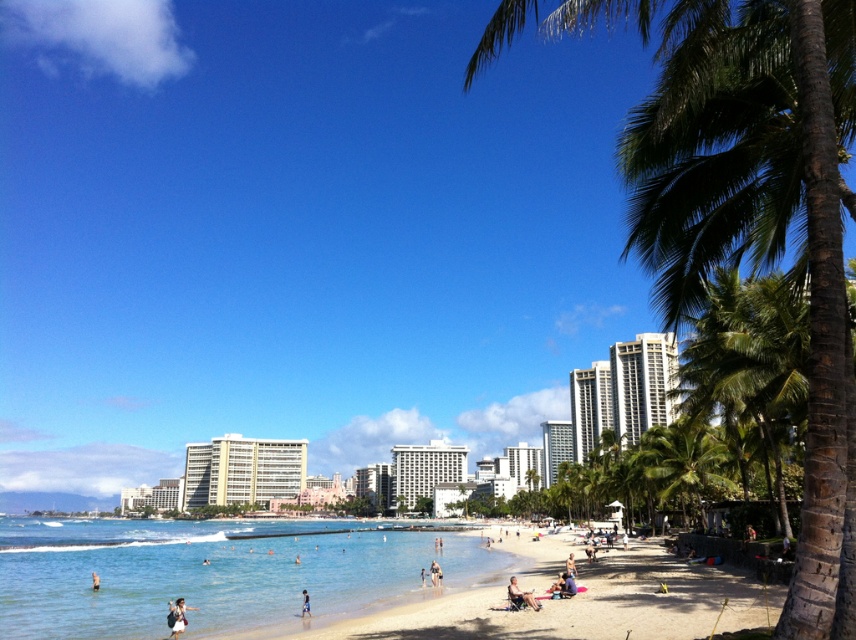
Between beige concrete building at center and light blue fabric at beach center, which one appears on the left side from the viewer's perspective?

beige concrete building at center is more to the left.

Does point (197, 493) come behind point (431, 573)?

That is True.

Locate an element on the screen. The width and height of the screenshot is (856, 640). beige concrete building at center is located at coordinates (242, 470).

Which is below, beige concrete building at center or green leafy palm tree at center-right?

beige concrete building at center

Does beige concrete building at center appear on the right side of green leafy palm tree at center-right?

Incorrect, beige concrete building at center is not on the right side of green leafy palm tree at center-right.

Does point (236, 451) come in front of point (655, 490)?

No, it is not.

You are a GUI agent. You are given a task and a screenshot of the screen. Output one action in this format:
    pyautogui.click(x=<x>, y=<y>)
    Task: Click on the beige concrete building at center
    The width and height of the screenshot is (856, 640).
    Given the screenshot: What is the action you would take?
    pyautogui.click(x=242, y=470)

Who is taller, green leafy palm tree at right or light blue fabric at beach center?

Standing taller between the two is green leafy palm tree at right.

Looking at this image, is green leafy palm tree at right taller than light blue fabric at beach center?

Indeed, green leafy palm tree at right has a greater height compared to light blue fabric at beach center.

Based on the photo, who is more forward, (854, 106) or (437, 586)?

Positioned in front is point (854, 106).

Identify the location of green leafy palm tree at right. (747, 209).